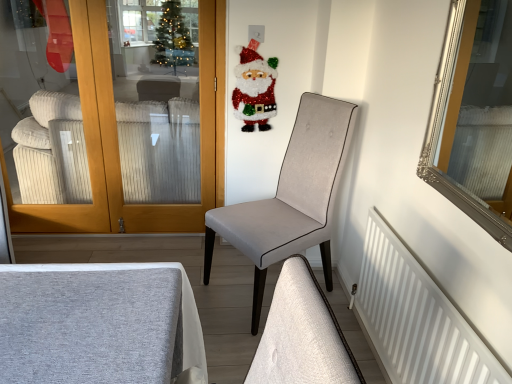
In order to click on vacant space underneath silver/glass mirror at upper right (from a real-world perspective) in this screenshot , I will do `click(431, 273)`.